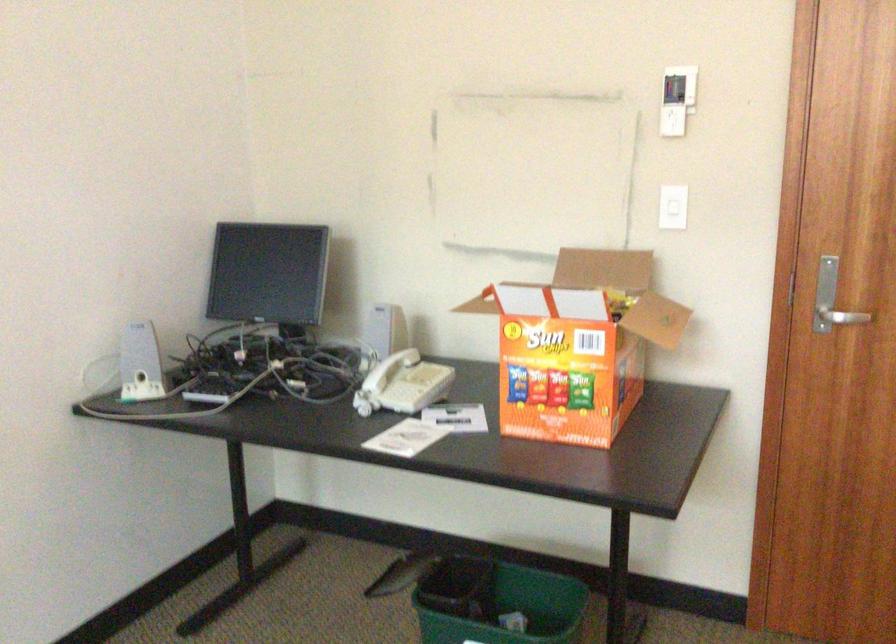
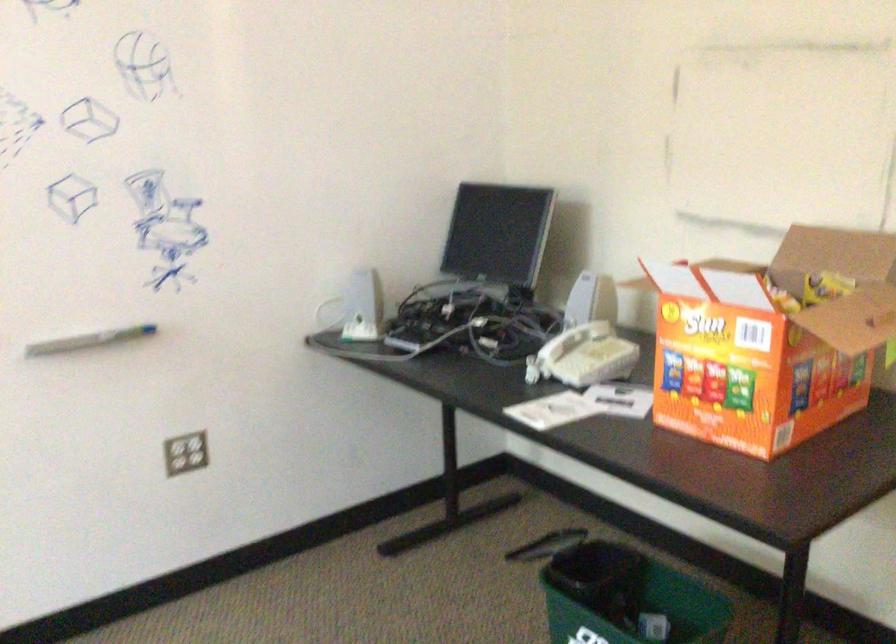
Question: The images are taken continuously from a first-person perspective. In which direction is your viewpoint rotating?

Choices:
 (A) Left
 (B) Right
 (C) Up
 (D) Down

Answer: (A)